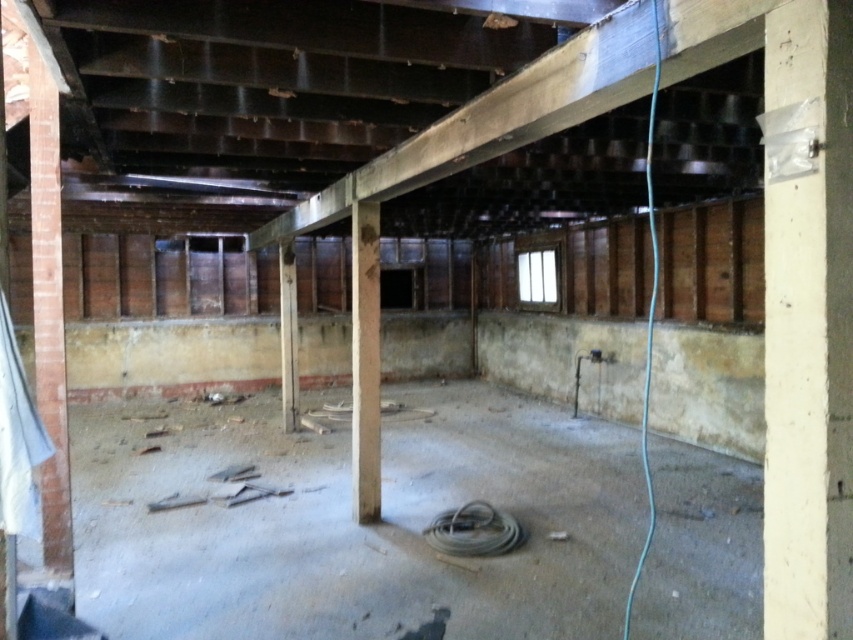
You are a construction worker in the room and need to reach the white painted wood pillar at right and the dark brown wooden beam at upper center. Which one is located to the right of the other?

The white painted wood pillar at right is positioned on the right side of dark brown wooden beam at upper center, so the white painted wood pillar at right is to the right of the dark brown wooden beam at upper center.